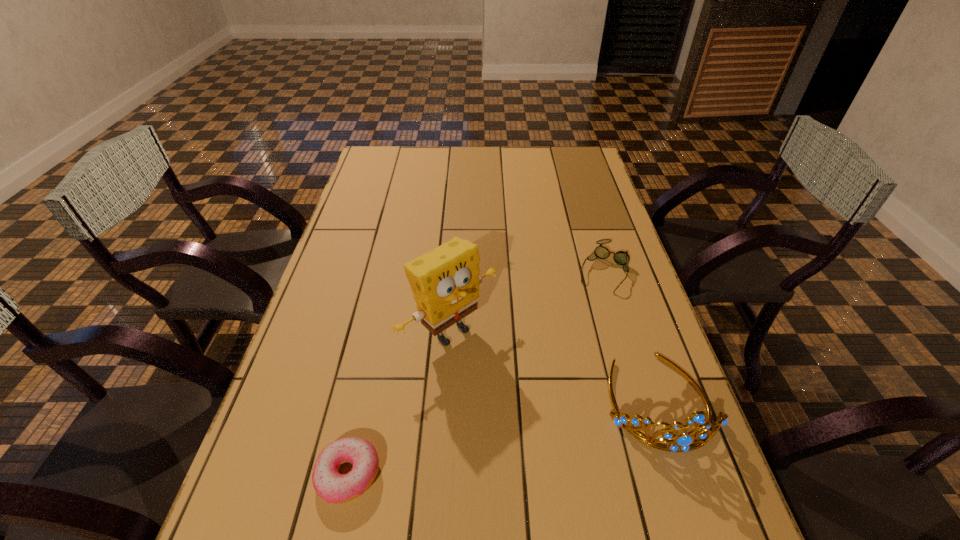
Find the location of a particular element. The width and height of the screenshot is (960, 540). the leftmost object is located at coordinates (331, 486).

Locate an element on the screen. The image size is (960, 540). tiara is located at coordinates (684, 442).

You are a GUI agent. You are given a task and a screenshot of the screen. Output one action in this format:
    pyautogui.click(x=<x>, y=<y>)
    Task: Click on the second object from left to right
    This screenshot has width=960, height=540.
    Given the screenshot: What is the action you would take?
    pyautogui.click(x=445, y=282)

Image resolution: width=960 pixels, height=540 pixels. I want to click on sponge, so click(445, 282).

Locate an element on the screen. The height and width of the screenshot is (540, 960). spectacles is located at coordinates (621, 258).

Locate an element on the screen. vacant region located 0.100m on the back of the doughnut is located at coordinates (364, 401).

You are a GUI agent. You are given a task and a screenshot of the screen. Output one action in this format:
    pyautogui.click(x=<x>, y=<y>)
    Task: Click on the vacant area situated 0.100m on the front-facing side of the tiara
    This screenshot has height=540, width=960.
    Given the screenshot: What is the action you would take?
    [x=696, y=509]

Identify the location of vacant space located 0.310m on the face of the third object from right to left. (583, 451).

At what (x,y) coordinates should I click in order to perform the action: click on free space located 0.130m on the face of the third object from right to left. Please return your answer as a coordinate pair (x, y). Looking at the image, I should click on (520, 393).

What are the coordinates of `vacant region located on the face of the third object from right to left` in the screenshot? It's located at (520, 393).